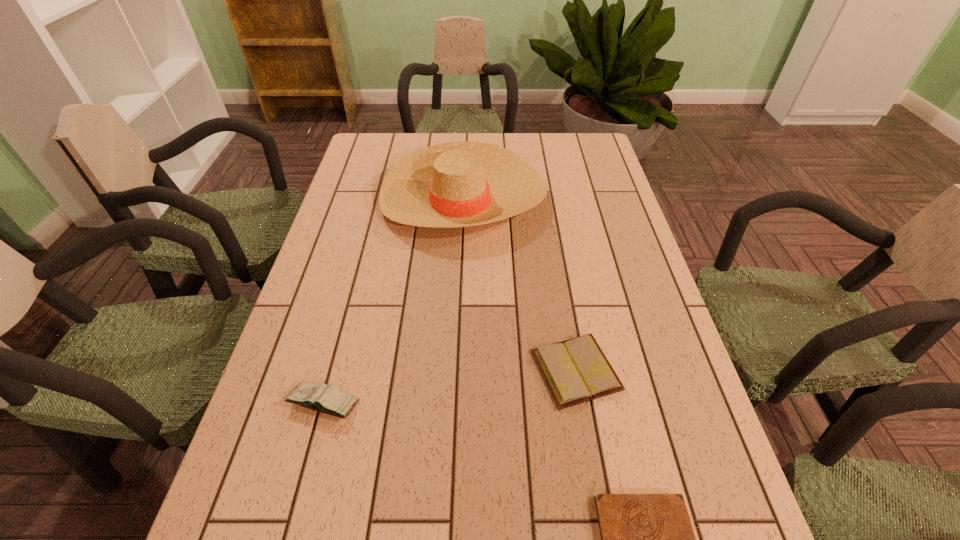
What are the coordinates of `sunhat` in the screenshot? It's located at (458, 184).

The image size is (960, 540). I want to click on the farthest object, so click(x=458, y=184).

Find the location of a particular element. The height and width of the screenshot is (540, 960). the second tallest object is located at coordinates (326, 399).

Find the location of `the leftmost diary`. the leftmost diary is located at coordinates (326, 399).

You are a GUI agent. You are given a task and a screenshot of the screen. Output one action in this format:
    pyautogui.click(x=<x>, y=<y>)
    Task: Click on the free spot located 0.060m on the left of the sunhat
    The width and height of the screenshot is (960, 540).
    Given the screenshot: What is the action you would take?
    pyautogui.click(x=362, y=200)

Find the location of a particular element. free location located 0.180m on the back of the leftmost diary is located at coordinates (348, 315).

Locate an element on the screen. The height and width of the screenshot is (540, 960). object at the far edge is located at coordinates (458, 184).

Locate an element on the screen. sunhat at the left edge is located at coordinates (458, 184).

Identify the location of diary located at the left edge. (326, 399).

I want to click on object that is at the right edge, so click(576, 370).